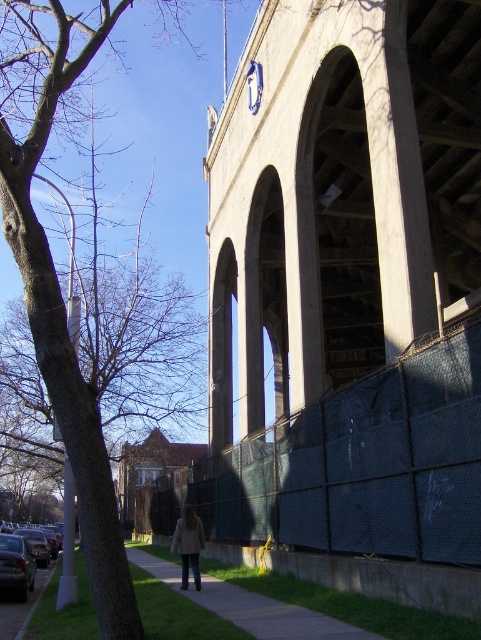
Question: Can you confirm if dark green mesh fence at lower center is wider than brown leafless tree at left?

Choices:
 (A) yes
 (B) no

Answer: (B)

Question: Which object is closer to the camera taking this photo?

Choices:
 (A) light brown wool coat at lower center
 (B) brown leafless tree at left
 (C) concrete sidewalk at lower center
 (D) dark green mesh fence at lower center

Answer: (B)

Question: Which object is closer to the camera taking this photo?

Choices:
 (A) dark green mesh fence at lower center
 (B) concrete sidewalk at lower center
 (C) brown leafless tree at left

Answer: (C)

Question: Among these points, which one is farthest from the camera?

Choices:
 (A) (245, 602)
 (B) (182, 547)

Answer: (B)

Question: Is concrete/stone bridge at center bigger than dark green mesh fence at lower center?

Choices:
 (A) yes
 (B) no

Answer: (A)

Question: Can you confirm if brown leafless tree at left is positioned to the left of concrete sidewalk at lower center?

Choices:
 (A) yes
 (B) no

Answer: (A)